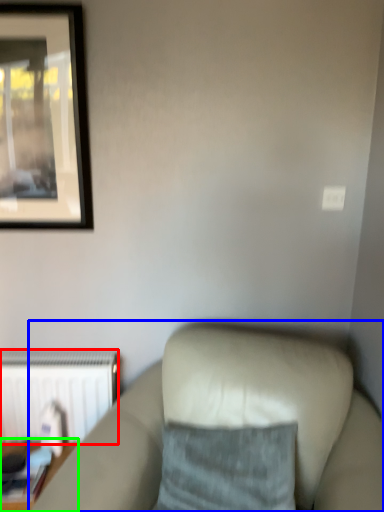
Question: Estimate the real-world distances between objects in this image. Which object is closer to radiator (highlighted by a red box), studio couch (highlighted by a blue box) or table (highlighted by a green box)?

Choices:
 (A) studio couch
 (B) table

Answer: (B)